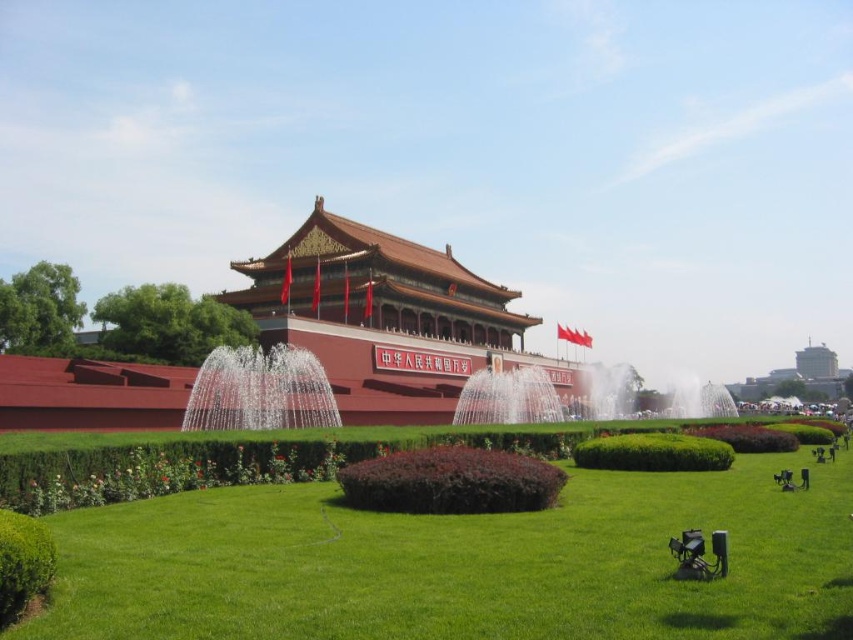
Question: Which of the following is the closest to the observer?

Choices:
 (A) (196, 397)
 (B) (469, 413)
 (C) (482, 291)
 (D) (537, 598)

Answer: (D)

Question: Which point is closer to the camera taking this photo?

Choices:
 (A) (427, 380)
 (B) (206, 404)

Answer: (B)

Question: Can you confirm if green grass at center is wider than clear water fountain at center?

Choices:
 (A) yes
 (B) no

Answer: (A)

Question: Which point is farther from the camera taking this photo?

Choices:
 (A) (447, 356)
 (B) (302, 420)

Answer: (A)

Question: Does reddish-brown stone palace at center appear over clear water fountain at center?

Choices:
 (A) yes
 (B) no

Answer: (A)

Question: Is reddish-brown stone palace at center behind white water at center?

Choices:
 (A) yes
 (B) no

Answer: (B)